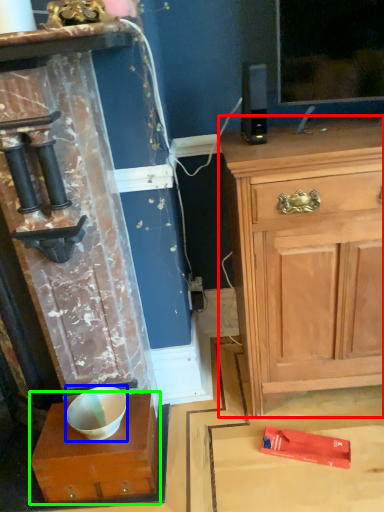
Question: Which is farther away from chest of drawers (highlighted by a red box)? bowl (highlighted by a blue box) or cabinetry (highlighted by a green box)?

Choices:
 (A) bowl
 (B) cabinetry

Answer: (A)